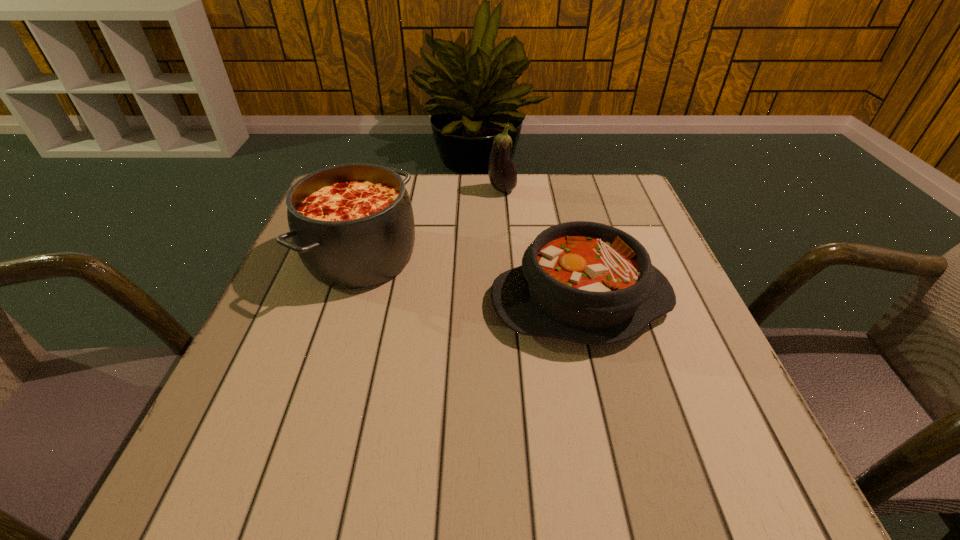
This screenshot has height=540, width=960. What are the coordinates of `eggplant` in the screenshot? It's located at [x=502, y=174].

Identify the location of the taller casserole. This screenshot has height=540, width=960. (352, 225).

Where is `the left casserole`? The image size is (960, 540). the left casserole is located at coordinates (352, 225).

The height and width of the screenshot is (540, 960). I want to click on the right casserole, so click(x=590, y=283).

Where is `the shorter casserole`? Image resolution: width=960 pixels, height=540 pixels. the shorter casserole is located at coordinates (590, 283).

Locate an element on the screen. Image resolution: width=960 pixels, height=540 pixels. vacant position located on the right of the farthest object is located at coordinates (590, 191).

Locate an element on the screen. vacant space located on the back of the taller casserole is located at coordinates (380, 197).

Image resolution: width=960 pixels, height=540 pixels. Find the location of `vacant space located on the left of the right casserole`. vacant space located on the left of the right casserole is located at coordinates [385, 301].

Identify the location of eggplant that is at the far edge. (502, 174).

Where is `casserole located at the far edge`? Image resolution: width=960 pixels, height=540 pixels. casserole located at the far edge is located at coordinates (352, 225).